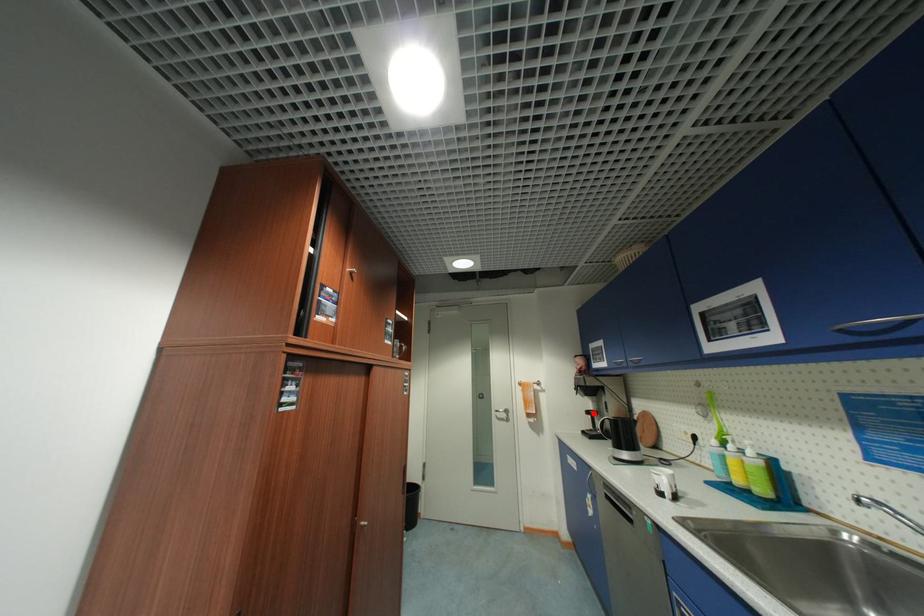
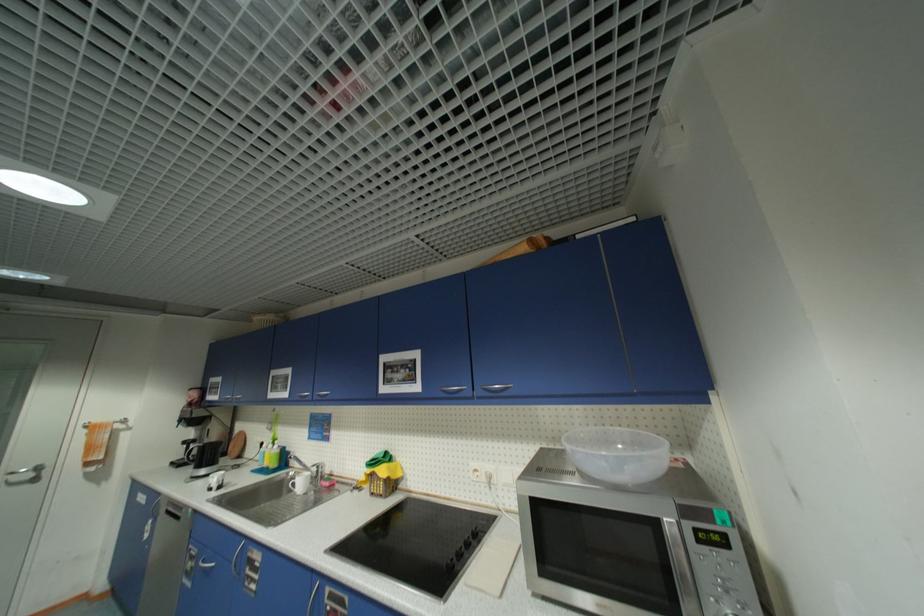
Locate, in the second image, the point that corresponds to the highlighted location in the first image.

(190, 444)